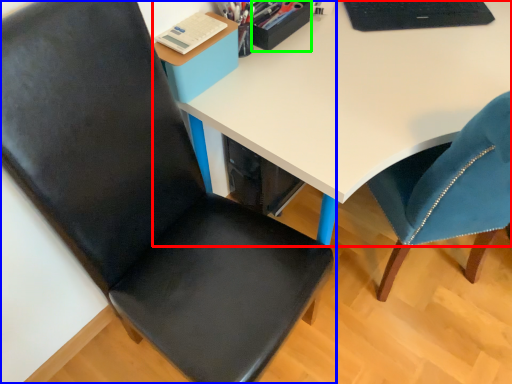
Question: Estimate the real-world distances between objects in this image. Which object is closer to desk (highlighted by a red box), chair (highlighted by a blue box) or stationery (highlighted by a green box)?

Choices:
 (A) chair
 (B) stationery

Answer: (B)